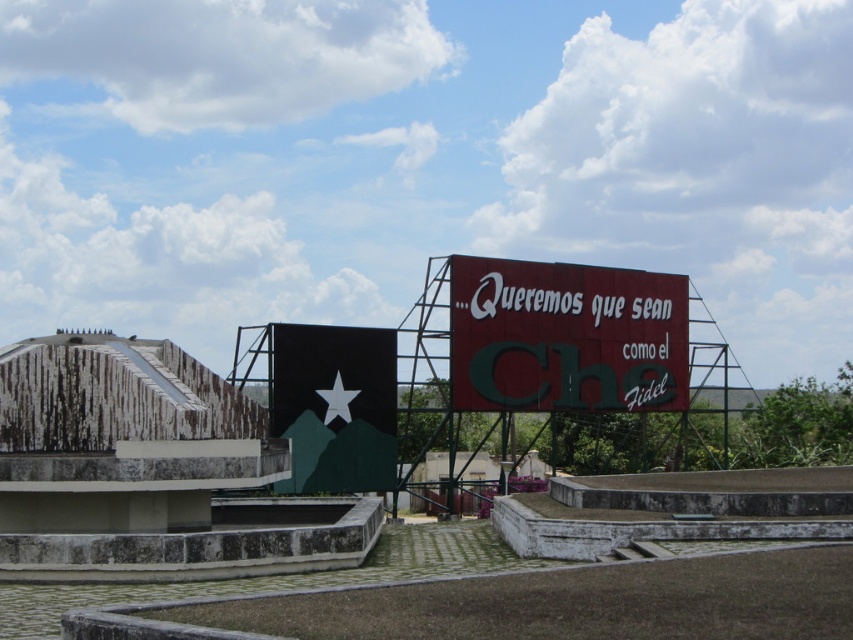
Is green concrete sign at upper center to the left of black matte sign at center from the viewer's perspective?

Incorrect, green concrete sign at upper center is not on the left side of black matte sign at center.

Who is higher up, green concrete sign at upper center or black matte sign at center?

black matte sign at center

Locate an element on the screen. Image resolution: width=853 pixels, height=640 pixels. green concrete sign at upper center is located at coordinates (206, 545).

Find the location of a particular element. This screenshot has height=640, width=853. green concrete sign at upper center is located at coordinates tap(206, 545).

Who is higher up, red matte sign at upper right or black matte sign at center?

red matte sign at upper right is above.

Describe the element at coordinates (566, 337) in the screenshot. Image resolution: width=853 pixels, height=640 pixels. I see `red matte sign at upper right` at that location.

Locate an element on the screen. Image resolution: width=853 pixels, height=640 pixels. red matte sign at upper right is located at coordinates (566, 337).

Who is positioned more to the right, green concrete sign at upper center or red matte sign at upper right?

red matte sign at upper right is more to the right.

Does green concrete sign at upper center have a lesser height compared to red matte sign at upper right?

Incorrect, green concrete sign at upper center's height does not fall short of red matte sign at upper right's.

Who is more distant from viewer, (216, 577) or (506, 408)?

Positioned behind is point (506, 408).

This screenshot has width=853, height=640. I want to click on green concrete sign at upper center, so click(x=206, y=545).